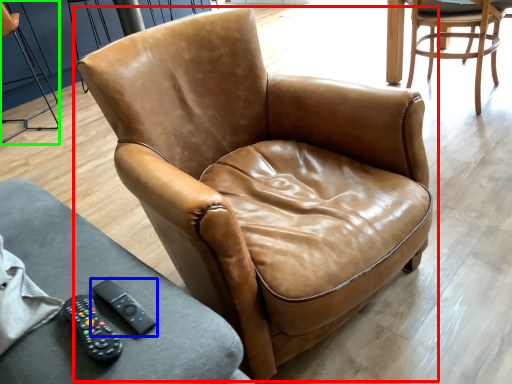
Question: Considering the real-world distances, which object is farthest from chair (highlighted by a red box)? remote (highlighted by a blue box) or chair (highlighted by a green box)?

Choices:
 (A) remote
 (B) chair

Answer: (B)